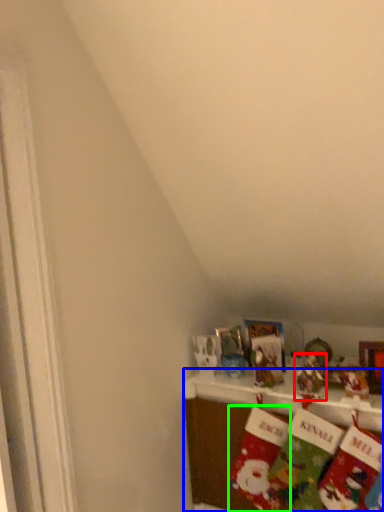
Question: Which is nearer to the toy (highlighted by a red box)? shelf (highlighted by a blue box) or sock (highlighted by a green box).

Choices:
 (A) shelf
 (B) sock

Answer: (B)